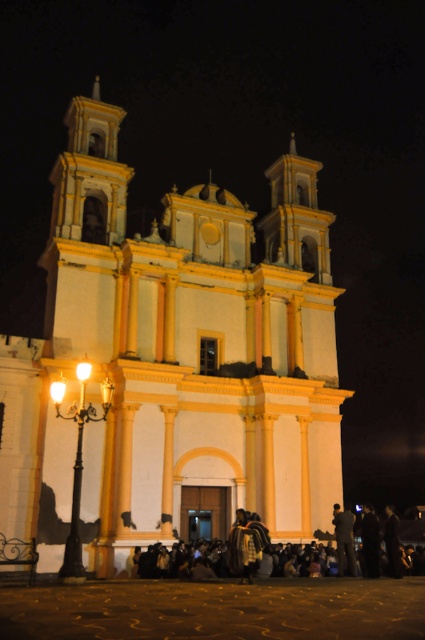
Who is higher up, yellow matte church at center or dark gray fabric jacket at lower center?

Positioned higher is yellow matte church at center.

Which is behind, point (53, 349) or point (351, 529)?

The point (53, 349) is behind.

This screenshot has height=640, width=425. I want to click on yellow matte church at center, so click(173, 362).

Is dark gray fabric jacket at lower center smaller than dark fabric jacket at lower center?

Yes, dark gray fabric jacket at lower center is smaller than dark fabric jacket at lower center.

Which is behind, point (348, 538) or point (363, 532)?

Positioned behind is point (363, 532).

The width and height of the screenshot is (425, 640). In order to click on dark gray fabric jacket at lower center in this screenshot , I will do [343, 538].

Is yellow matte church at center to the left of dark fabric jacket at lower center from the viewer's perspective?

Indeed, yellow matte church at center is positioned on the left side of dark fabric jacket at lower center.

Is yellow matte church at center taller than dark fabric jacket at lower center?

Yes.

Is point (82, 262) closer to camera compared to point (367, 544)?

No, it is behind (367, 544).

The image size is (425, 640). Find the location of `yellow matte church at center`. yellow matte church at center is located at coordinates (173, 362).